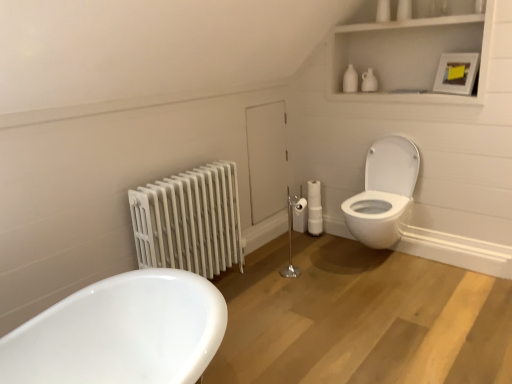
Question: Would you say silver metallic toilet paper holder at center is part of white glossy toilet at right's contents?

Choices:
 (A) no
 (B) yes

Answer: (A)

Question: Does white glossy toilet at right lie behind silver metallic toilet paper holder at center?

Choices:
 (A) no
 (B) yes

Answer: (A)

Question: Is white glossy toilet at right aimed at silver metallic toilet paper holder at center?

Choices:
 (A) no
 (B) yes

Answer: (A)

Question: Considering the relative sizes of white glossy toilet at right and silver metallic toilet paper holder at center in the image provided, is white glossy toilet at right taller than silver metallic toilet paper holder at center?

Choices:
 (A) yes
 (B) no

Answer: (A)

Question: From the image's perspective, is white glossy toilet at right on silver metallic toilet paper holder at center?

Choices:
 (A) no
 (B) yes

Answer: (B)

Question: From their relative heights in the image, would you say silver metallic toilet paper holder at center is taller or shorter than white glossy toilet at right?

Choices:
 (A) short
 (B) tall

Answer: (A)

Question: From a real-world perspective, relative to white glossy toilet at right, is silver metallic toilet paper holder at center vertically above or below?

Choices:
 (A) below
 (B) above

Answer: (A)

Question: Is point (296, 198) closer or farther from the camera than point (388, 147)?

Choices:
 (A) closer
 (B) farther

Answer: (B)

Question: Is silver metallic toilet paper holder at center wider or thinner than white glossy toilet at right?

Choices:
 (A) thin
 (B) wide

Answer: (A)

Question: Is white painted metal radiator at left wider or thinner than silver metallic toilet paper holder at center?

Choices:
 (A) thin
 (B) wide

Answer: (B)

Question: Is white painted metal radiator at left inside the boundaries of silver metallic toilet paper holder at center, or outside?

Choices:
 (A) inside
 (B) outside

Answer: (B)

Question: From the image's perspective, is white painted metal radiator at left above or below silver metallic toilet paper holder at center?

Choices:
 (A) above
 (B) below

Answer: (A)

Question: From a real-world perspective, is white painted metal radiator at left above or below silver metallic toilet paper holder at center?

Choices:
 (A) above
 (B) below

Answer: (A)

Question: Visually, is white glossy toilet at right positioned to the left or to the right of white matte cabinet at upper right?

Choices:
 (A) right
 (B) left

Answer: (B)

Question: Relative to white matte cabinet at upper right, is white glossy toilet at right in front or behind?

Choices:
 (A) behind
 (B) front

Answer: (A)